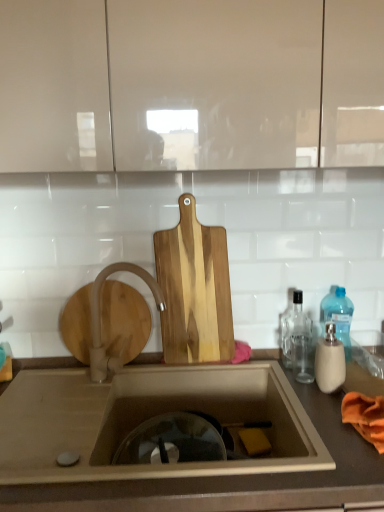
What do you see at coordinates (190, 84) in the screenshot?
I see `matte white cabinet at upper center` at bounding box center [190, 84].

Describe the element at coordinates (234, 478) in the screenshot. This screenshot has height=512, width=384. I see `brown matte countertop at lower center` at that location.

Identify the location of beige matte soap dispenser at right, marked as the third bottle in a back-to-front arrangement. (330, 360).

Is white matte faucet at sink left shorter than brown matte countertop at lower center?

Yes.

Can brown matte countertop at lower center be found inside white matte faucet at sink left?

Definitely not — brown matte countertop at lower center is not inside white matte faucet at sink left.

Is point (117, 367) positioned before point (335, 473)?

No.

Is white matte faucet at sink left with brown matte countertop at lower center?

No.

Is beige matte soap dispenser at right, marked as the third bottle in a back-to-front arrangement, at the left side of blue translucent bottle at right, the 3th bottle when ordered from front to back?

Yes.

Do you think beige matte soap dispenser at right, marked as the third bottle in a back-to-front arrangement, is within blue translucent bottle at right, the 3th bottle when ordered from front to back, or outside of it?

beige matte soap dispenser at right, marked as the third bottle in a back-to-front arrangement, cannot be found inside blue translucent bottle at right, the 3th bottle when ordered from front to back.

In terms of height, does beige matte soap dispenser at right, arranged as the first bottle when viewed from the front, look taller or shorter compared to blue translucent bottle at right, the 1th bottle in the back-to-front sequence?

beige matte soap dispenser at right, arranged as the first bottle when viewed from the front, is shorter than blue translucent bottle at right, the 1th bottle in the back-to-front sequence.

From a real-world perspective, who is located higher, beige matte soap dispenser at right, marked as the third bottle in a back-to-front arrangement, or blue translucent bottle at right, the 3th bottle when ordered from front to back?

In real-world perspective, blue translucent bottle at right, the 3th bottle when ordered from front to back, is above.

Is white matte faucet at sink left completely or partially inside brown matte countertop at lower center?

No, white matte faucet at sink left is located outside of brown matte countertop at lower center.

Looking at this image, is brown matte countertop at lower center at the left side of white matte faucet at sink left?

Incorrect, brown matte countertop at lower center is not on the left side of white matte faucet at sink left.

Could you tell me if brown matte countertop at lower center is turned towards white matte faucet at sink left?

No, brown matte countertop at lower center does not turn towards white matte faucet at sink left.

From a real-world perspective, is brown matte countertop at lower center positioned above or below white matte faucet at sink left?

From a real-world perspective, brown matte countertop at lower center is physically below white matte faucet at sink left.

Considering their positions, is blue translucent bottle at right, the 3th bottle when ordered from front to back, located in front of or behind natural wood cutting board at center?

blue translucent bottle at right, the 3th bottle when ordered from front to back, is behind natural wood cutting board at center.

From a real-world perspective, is blue translucent bottle at right, the 3th bottle when ordered from front to back, positioned above or below natural wood cutting board at center?

blue translucent bottle at right, the 3th bottle when ordered from front to back, is below natural wood cutting board at center.

Looking at this image, is blue translucent bottle at right, the 1th bottle in the back-to-front sequence, oriented towards natural wood cutting board at center?

No, blue translucent bottle at right, the 1th bottle in the back-to-front sequence, is not turned towards natural wood cutting board at center.

Considering the sizes of objects blue translucent bottle at right, the 3th bottle when ordered from front to back, and natural wood cutting board at center in the image provided, who is shorter, blue translucent bottle at right, the 3th bottle when ordered from front to back, or natural wood cutting board at center?

blue translucent bottle at right, the 3th bottle when ordered from front to back, is shorter.

Can you tell me how much white matte faucet at sink left and beige matte soap dispenser at right, arranged as the first bottle when viewed from the front, differ in facing direction?

The angular difference between white matte faucet at sink left and beige matte soap dispenser at right, arranged as the first bottle when viewed from the front, is 63.9 degrees.

Can you confirm if white matte faucet at sink left is shorter than beige matte soap dispenser at right, arranged as the first bottle when viewed from the front?

No, white matte faucet at sink left is not shorter than beige matte soap dispenser at right, arranged as the first bottle when viewed from the front.

Is white matte faucet at sink left facing away from beige matte soap dispenser at right, arranged as the first bottle when viewed from the front?

white matte faucet at sink left does not have its back to beige matte soap dispenser at right, arranged as the first bottle when viewed from the front.

Considering the positions of objects natural wood cutting board at center and blue translucent bottle at right, the 3th bottle when ordered from front to back, in the image provided, who is behind, natural wood cutting board at center or blue translucent bottle at right, the 3th bottle when ordered from front to back,?

blue translucent bottle at right, the 3th bottle when ordered from front to back, is further from the camera.

Is natural wood cutting board at center far away from blue translucent bottle at right, the 1th bottle in the back-to-front sequence?

No, natural wood cutting board at center is in close proximity to blue translucent bottle at right, the 1th bottle in the back-to-front sequence.

How many degrees apart are the facing directions of natural wood cutting board at center and blue translucent bottle at right, the 3th bottle when ordered from front to back?

There is a 1.4-degree angle between the facing directions of natural wood cutting board at center and blue translucent bottle at right, the 3th bottle when ordered from front to back.

Is point (190, 310) less distant than point (349, 329)?

Yes, point (190, 310) is in front of point (349, 329).

The image size is (384, 512). In the image, there is a white matte faucet at sink left. In order to click on cabinetry above it (from the image's perspective) in this screenshot , I will do `click(190, 84)`.

Is white matte faucet at sink left next to matte white cabinet at upper center and touching it?

They are not placed beside each other.

How many degrees apart are the facing directions of white matte faucet at sink left and matte white cabinet at upper center?

64 degrees separate the facing orientations of white matte faucet at sink left and matte white cabinet at upper center.

From the image's perspective, who appears lower, white matte faucet at sink left or matte white cabinet at upper center?

white matte faucet at sink left is shown below in the image.

At what (x,y) coordinates should I click in order to perform the action: click on countertop in front of the white matte faucet at sink left. Please return your answer as a coordinate pair (x, y). This screenshot has width=384, height=512. Looking at the image, I should click on (234, 478).

What are the coordinates of `bottle that is the 2nd one when counting upward from the beige matte soap dispenser at right, arranged as the first bottle when viewed from the front (from the image's perspective)` in the screenshot? It's located at (338, 316).

Estimate the real-world distances between objects in this image. Which object is further from brown matte countertop at lower center, blue translucent bottle at right, the 1th bottle in the back-to-front sequence, or beige matte soap dispenser at right, arranged as the first bottle when viewed from the front?

blue translucent bottle at right, the 1th bottle in the back-to-front sequence.

Which object lies nearer to the anchor point transparent glass bottle at right, the 2th bottle when ordered from front to back, blue translucent bottle at right, the 1th bottle in the back-to-front sequence, or natural wood cutting board at center?

The object closer to transparent glass bottle at right, the 2th bottle when ordered from front to back, is blue translucent bottle at right, the 1th bottle in the back-to-front sequence.

Considering their positions, is blue translucent bottle at right, the 3th bottle when ordered from front to back, positioned further to brown matte countertop at lower center than matte white cabinet at upper center?

matte white cabinet at upper center.

When comparing their distances from natural wood cutting board at center, does matte white cabinet at upper center or white matte faucet at sink left seem closer?

white matte faucet at sink left.

Looking at the image, which one is located closer to beige matte soap dispenser at right, marked as the third bottle in a back-to-front arrangement, white matte faucet at sink left or matte white cabinet at upper center?

white matte faucet at sink left.

When comparing their distances from beige matte soap dispenser at right, marked as the third bottle in a back-to-front arrangement, does white matte faucet at sink left or brown matte countertop at lower center seem further?

white matte faucet at sink left.

From the image, which object appears to be nearer to white matte faucet at sink left, beige matte soap dispenser at right, marked as the third bottle in a back-to-front arrangement, or natural wood cutting board at center?

natural wood cutting board at center lies closer to white matte faucet at sink left than the other object.

From the image, which object appears to be nearer to natural wood cutting board at center, white matte faucet at sink left or brown matte countertop at lower center?

The object closer to natural wood cutting board at center is white matte faucet at sink left.

This screenshot has height=512, width=384. Identify the location of cutting board situated between white matte faucet at sink left and blue translucent bottle at right, the 3th bottle when ordered from front to back, from left to right. point(194,289).

This screenshot has width=384, height=512. I want to click on bottle between natural wood cutting board at center and beige matte soap dispenser at right, marked as the third bottle in a back-to-front arrangement, so click(297, 339).

Locate an element on the screen. The height and width of the screenshot is (512, 384). cutting board between matte white cabinet at upper center and brown matte countertop at lower center in the vertical direction is located at coordinates (194, 289).

Find the location of a particular element. cutting board between matte white cabinet at upper center and beige matte soap dispenser at right, arranged as the first bottle when viewed from the front, in the up-down direction is located at coordinates (194, 289).